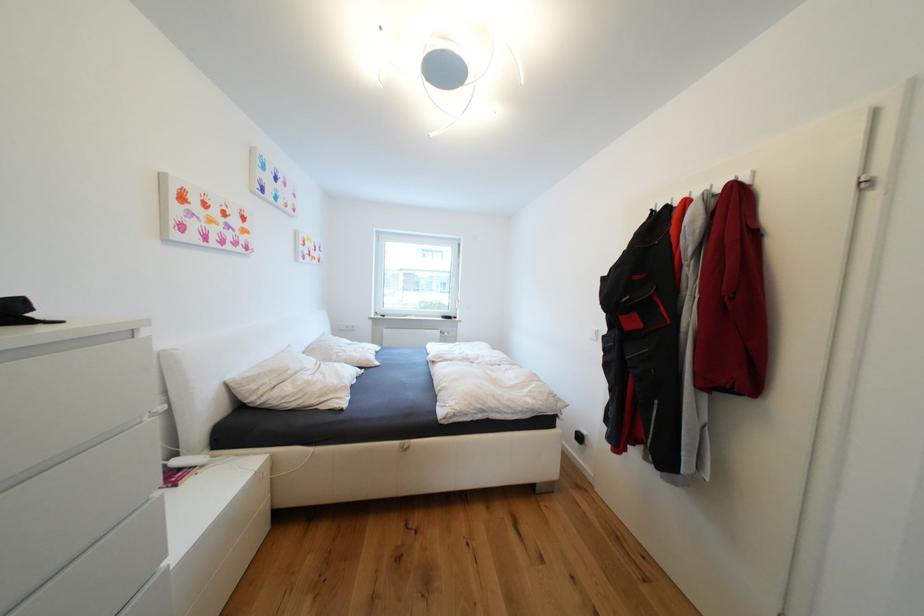
This screenshot has width=924, height=616. I want to click on white pillow, so click(x=297, y=391).